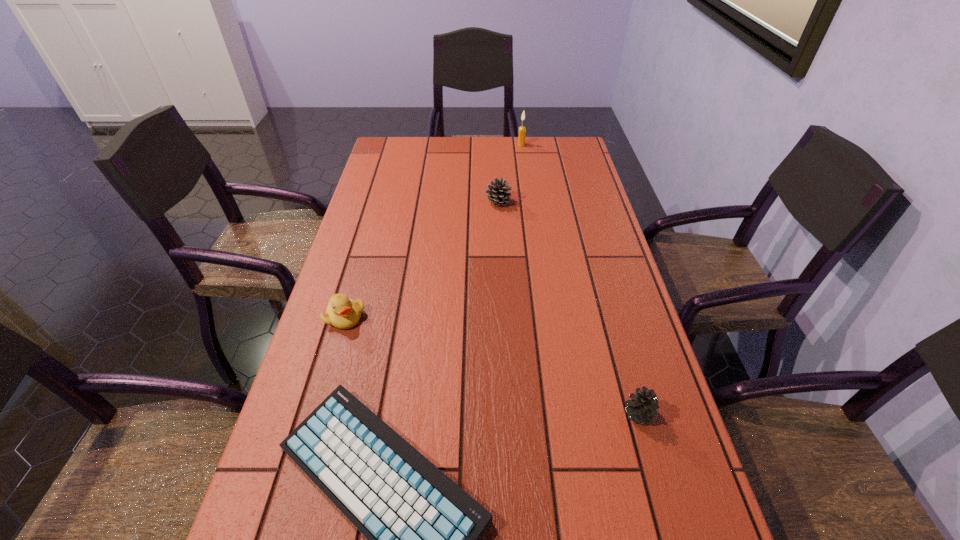
You are a GUI agent. You are given a task and a screenshot of the screen. Output one action in this format:
    pyautogui.click(x=<x>, y=<y>)
    Task: Click on the vacant space situated on the beak of the duckling
    Image resolution: width=960 pixels, height=540 pixels.
    Given the screenshot: What is the action you would take?
    pyautogui.click(x=316, y=415)

I want to click on object that is at the far edge, so click(522, 130).

You are a GUI agent. You are given a task and a screenshot of the screen. Output one action in this format:
    pyautogui.click(x=<x>, y=<y>)
    Task: Click on the object that is positioned at the left edge
    The image size is (960, 540).
    Given the screenshot: What is the action you would take?
    pyautogui.click(x=342, y=312)

Identify the location of object positioned at the right edge. (643, 406).

Where is `free region at the far edge of the desktop`? free region at the far edge of the desktop is located at coordinates (467, 137).

This screenshot has width=960, height=540. I want to click on vacant region at the left edge of the desktop, so click(379, 316).

The height and width of the screenshot is (540, 960). Identify the location of vacant space at the right edge of the desktop. (562, 190).

Where is `vacant space in between the tallest object and the duckling`? This screenshot has height=540, width=960. vacant space in between the tallest object and the duckling is located at coordinates (433, 231).

At what (x,y) coordinates should I click in order to perform the action: click on vacant space that is in between the right pinecone and the farther pinecone. Please return your answer as a coordinate pair (x, y). Looking at the image, I should click on (568, 308).

You are a GUI agent. You are given a task and a screenshot of the screen. Output one action in this format:
    pyautogui.click(x=<x>, y=<y>)
    Task: Click on the free space between the nearer pinecone and the candle
    The width and height of the screenshot is (960, 540).
    Given the screenshot: What is the action you would take?
    pyautogui.click(x=580, y=279)